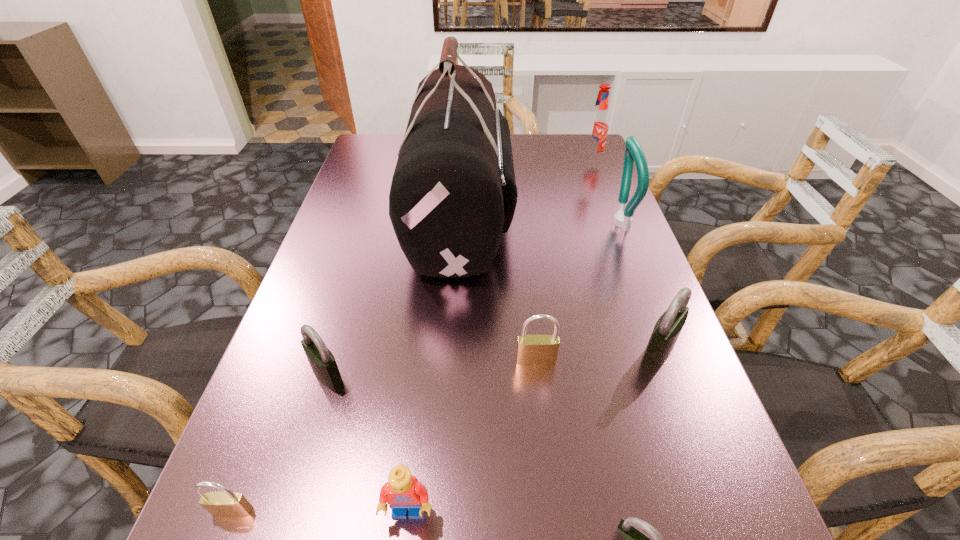
Locate an element on the screen. The image size is (960, 540). red duffel bag is located at coordinates [x=453, y=193].

I want to click on duffel bag, so click(x=453, y=193).

This screenshot has height=540, width=960. In order to click on root beer in this screenshot , I will do 597,128.

At what (x,y) coordinates should I click in order to perform the action: click on bottle opener. Please return your answer as a coordinate pair (x, y). Looking at the image, I should click on (633, 152).

Find the location of a particular element. This screenshot has width=960, height=540. the biggest black padlock is located at coordinates (667, 329).

The height and width of the screenshot is (540, 960). In order to click on the rightmost padlock in this screenshot , I will do (667, 329).

You are a GUI agent. You are given a task and a screenshot of the screen. Output one action in this format:
    pyautogui.click(x=<x>, y=<y>)
    Task: Click on the second object from left to right
    Image resolution: width=960 pixels, height=540 pixels.
    Given the screenshot: What is the action you would take?
    [x=323, y=364]

The height and width of the screenshot is (540, 960). I want to click on the second biggest black padlock, so click(x=323, y=364).

Find the location of a particular element. the right brass padlock is located at coordinates (532, 350).

Identify the location of the third padlock from left to right. Image resolution: width=960 pixels, height=540 pixels. (532, 350).